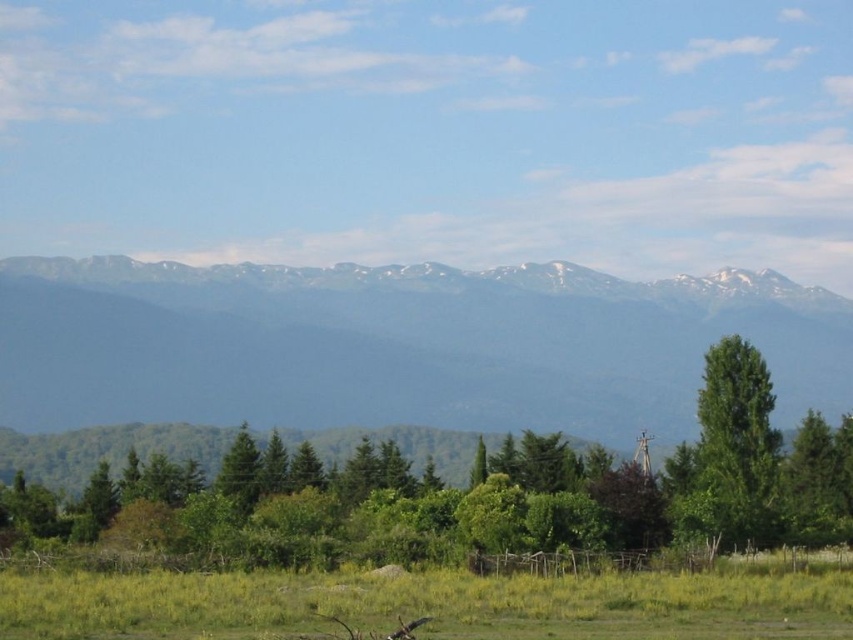
You are standing in the landscape and want to walk from the green leafy tree at center to the green leafy tree at right. Which direction should you move relative to the trees?

You should move to the right relative to the green leafy tree at center because the green leafy tree at right is positioned to its right side.